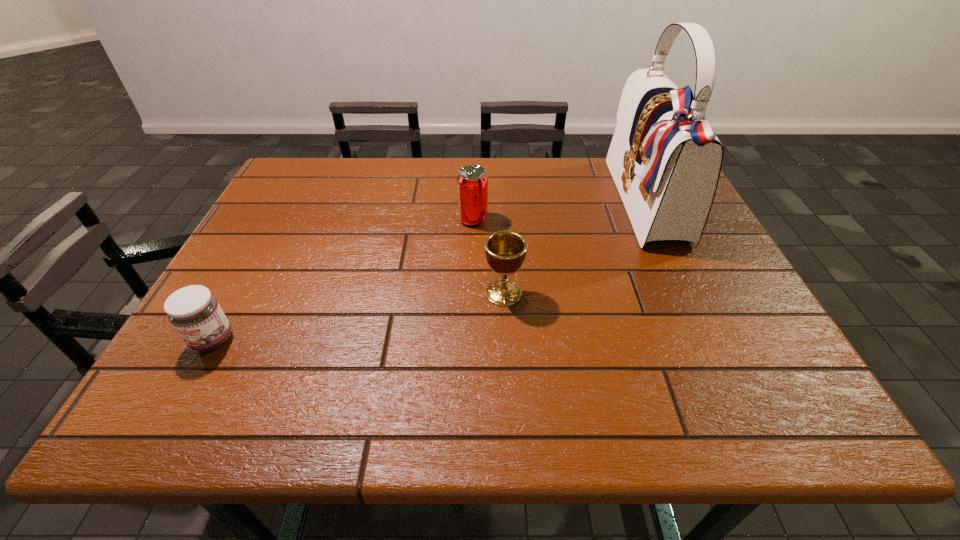
The height and width of the screenshot is (540, 960). Identify the location of empty space that is in between the rightmost object and the soda can. (560, 212).

This screenshot has width=960, height=540. Find the location of `object that is the second closest to the soda can`. object that is the second closest to the soda can is located at coordinates (665, 160).

The height and width of the screenshot is (540, 960). In order to click on the third closest object to the nearest object in this screenshot , I will do `click(665, 160)`.

Locate an element on the screen. The image size is (960, 540). free space that satisfies the following two spatial constraints: 1. on the front-facing side of the tallest object; 2. on the front label of the nearest object is located at coordinates (710, 340).

Image resolution: width=960 pixels, height=540 pixels. What are the coordinates of `vacant point that satisfies the following two spatial constraints: 1. on the front-facing side of the satchel; 2. on the front side of the third farthest object` in the screenshot? It's located at (688, 293).

You are a GUI agent. You are given a task and a screenshot of the screen. Output one action in this format:
    pyautogui.click(x=<x>, y=<y>)
    Task: Click on the free spot that satisfies the following two spatial constraints: 1. on the front-facing side of the satchel; 2. on the front side of the soda can
    The image size is (960, 540).
    Given the screenshot: What is the action you would take?
    pyautogui.click(x=654, y=219)

At what (x,y) coordinates should I click in order to perform the action: click on vacant space that satisfies the following two spatial constraints: 1. on the front-facing side of the satchel; 2. on the front side of the soda can. Please return your answer as a coordinate pair (x, y). This screenshot has height=540, width=960. Looking at the image, I should click on pyautogui.click(x=654, y=219).

Where is `vacant space that satisfies the following two spatial constraints: 1. on the front-facing side of the rightmost object; 2. on the front label of the shortest object`? The height and width of the screenshot is (540, 960). vacant space that satisfies the following two spatial constraints: 1. on the front-facing side of the rightmost object; 2. on the front label of the shortest object is located at coordinates (710, 340).

I want to click on vacant space that satisfies the following two spatial constraints: 1. on the front-facing side of the tallest object; 2. on the front label of the shortest object, so click(x=710, y=340).

Identify the location of vacant space that satisfies the following two spatial constraints: 1. on the front-facing side of the rightmost object; 2. on the front side of the second nearest object. (688, 293).